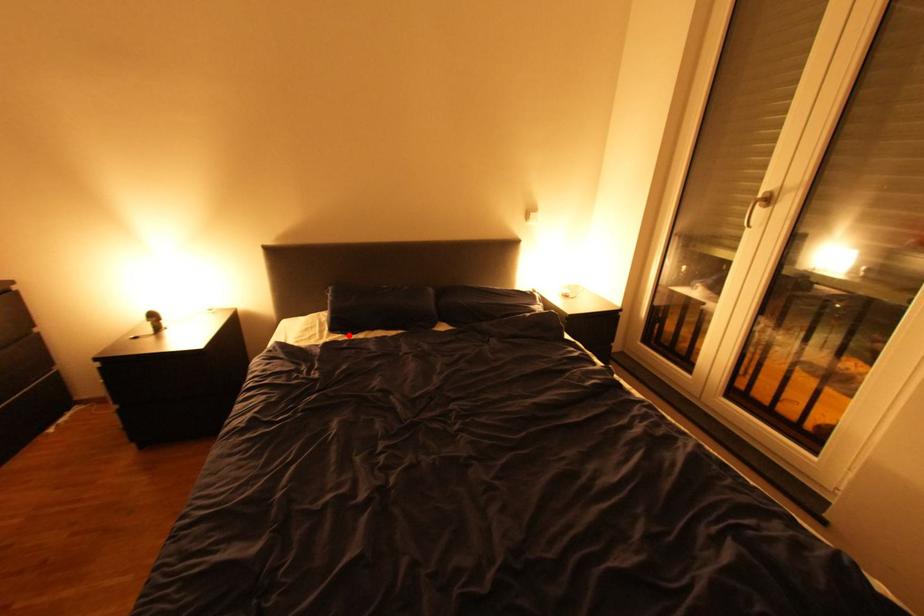
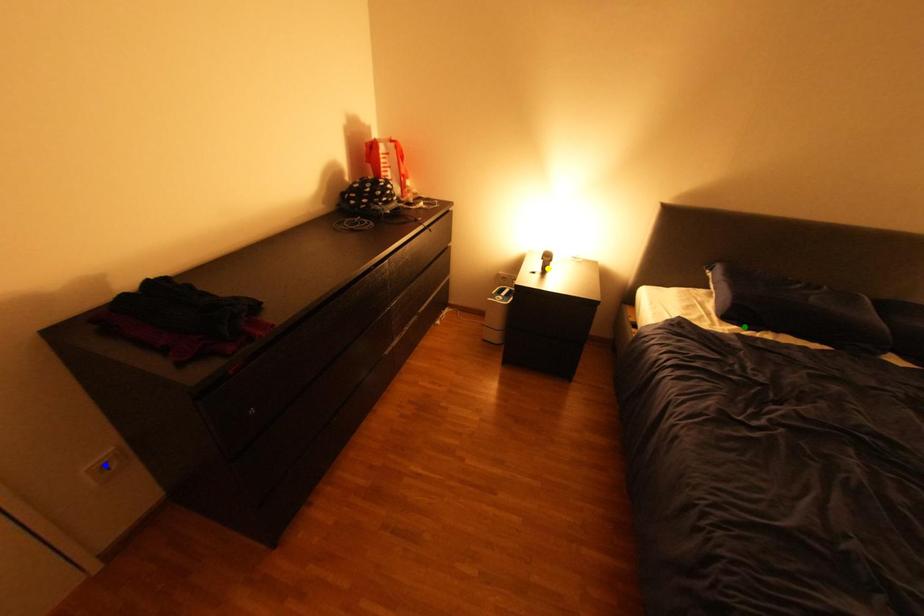
Question: I am providing you with two images of the same scene from different viewpoints. A red point is marked on the first image. You are given multiple points on the second image. In image 2, which mark is for the same physical point as the one in image 1?

Choices:
 (A) green point
 (B) yellow point
 (C) blue point

Answer: (A)